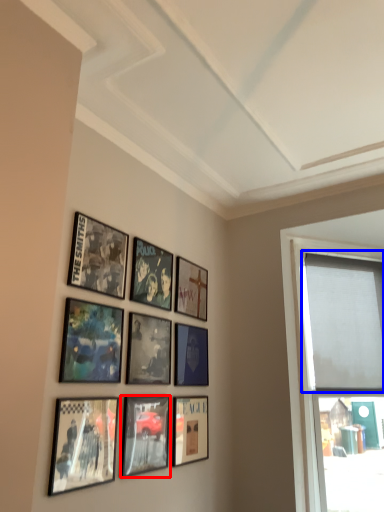
Question: Among these objects, which one is farthest to the camera, picture frame (highlighted by a red box) or window screen (highlighted by a blue box)?

Choices:
 (A) picture frame
 (B) window screen

Answer: (B)